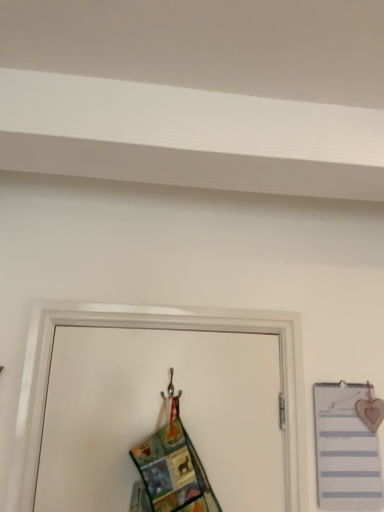
Question: Is point (188, 500) closer or farther from the camera than point (357, 451)?

Choices:
 (A) closer
 (B) farther

Answer: (A)

Question: Based on their sizes in the image, would you say multicolored fabric at center is bigger or smaller than white striped notebook at right?

Choices:
 (A) big
 (B) small

Answer: (A)

Question: In the image, is multicolored fabric at center positioned in front of or behind white striped notebook at right?

Choices:
 (A) behind
 (B) front

Answer: (B)

Question: From the image's perspective, relative to multicolored fabric at center, is white striped notebook at right above or below?

Choices:
 (A) below
 (B) above

Answer: (A)

Question: Considering the positions of point (344, 421) and point (148, 459), is point (344, 421) closer or farther from the camera than point (148, 459)?

Choices:
 (A) farther
 (B) closer

Answer: (A)

Question: Considering the positions of white striped notebook at right and multicolored fabric at center in the image, is white striped notebook at right wider or thinner than multicolored fabric at center?

Choices:
 (A) thin
 (B) wide

Answer: (A)

Question: Relative to multicolored fabric at center, is white striped notebook at right in front or behind?

Choices:
 (A) front
 (B) behind

Answer: (B)